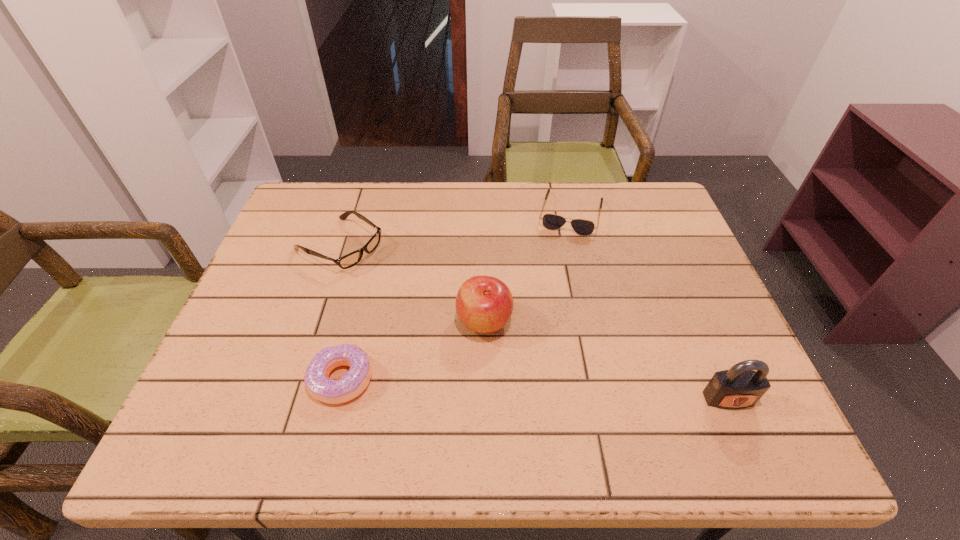
Where is `object that is at the left edge`? This screenshot has height=540, width=960. object that is at the left edge is located at coordinates (351, 259).

The image size is (960, 540). Identify the location of object located at the right edge. (740, 387).

Locate an element on the screen. Image resolution: width=960 pixels, height=540 pixels. object located in the far left corner section of the desktop is located at coordinates (351, 259).

This screenshot has height=540, width=960. What are the coordinates of `object that is at the near right corner` in the screenshot? It's located at (740, 387).

Where is `vacant space at the far edge`? vacant space at the far edge is located at coordinates (455, 225).

In the image, there is a desktop. Identify the location of vacant space at the near edge. The image size is (960, 540). (303, 375).

At what (x,y) coordinates should I click in order to perform the action: click on free space at the left edge. Please return your answer as a coordinate pair (x, y). This screenshot has width=960, height=540. Looking at the image, I should click on (282, 249).

The image size is (960, 540). What are the coordinates of `vacant space at the right edge of the desktop` in the screenshot? It's located at (727, 334).

Find the location of a particular element. Image resolution: width=960 pixels, height=540 pixels. free space at the far left corner of the desktop is located at coordinates (318, 200).

In the image, there is a desktop. At what (x,y) coordinates should I click in order to perform the action: click on vacant space at the far right corner. Please return your answer as a coordinate pair (x, y). The width and height of the screenshot is (960, 540). Looking at the image, I should click on (630, 190).